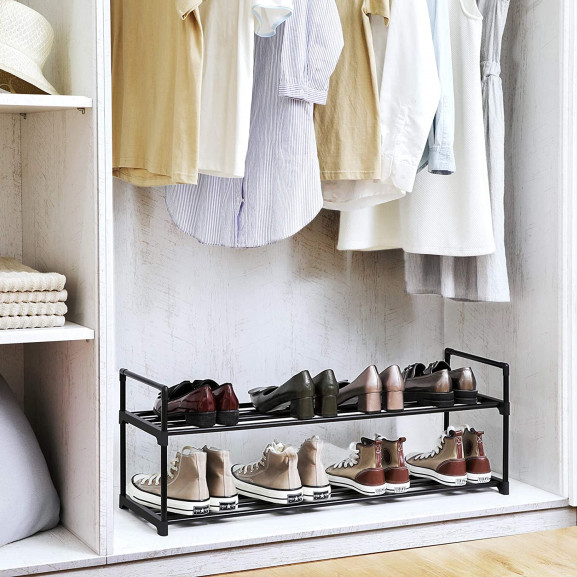
This screenshot has width=577, height=577. Identify the location of towels. (25, 276), (29, 295), (29, 305), (26, 321).